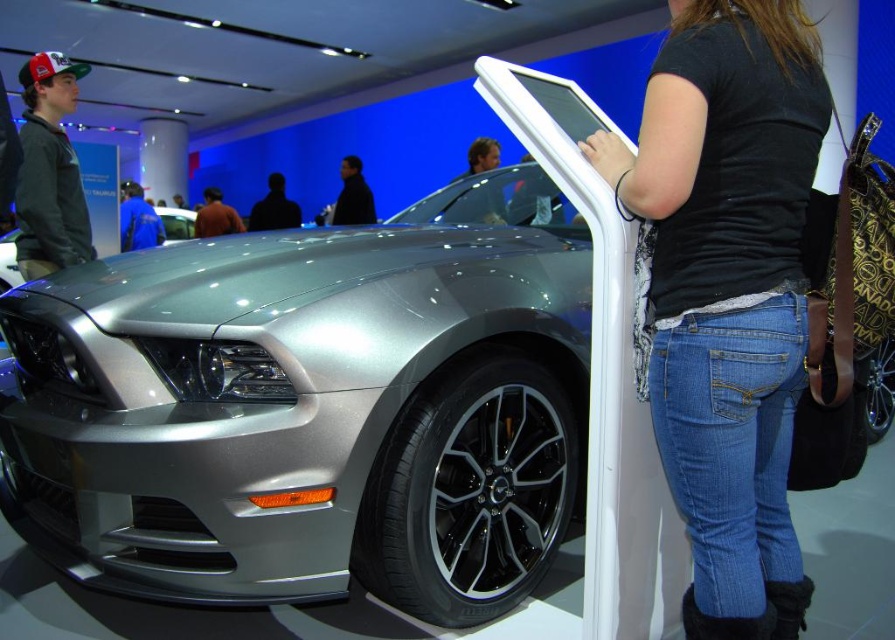
Which is more to the right, dark blue shirt at center or satin silver car at center?

dark blue shirt at center

Between point (362, 182) and point (166, 221), which one is positioned in front?

Point (166, 221) is in front.

Locate an element on the screen. dark blue shirt at center is located at coordinates (352, 195).

Is dark blue shirt at center above brown sweater at center?

Yes.

Does dark blue shirt at center have a lesser width compared to brown sweater at center?

No.

I want to click on dark blue shirt at center, so click(352, 195).

Is black denim jeans at center bigger than dark blue shirt at center?

No, black denim jeans at center is not bigger than dark blue shirt at center.

Does black denim jeans at center have a greater width compared to dark blue shirt at center?

Incorrect, black denim jeans at center's width does not surpass dark blue shirt at center's.

This screenshot has width=895, height=640. Identify the location of black denim jeans at center. (729, 291).

Locate an element on the screen. black denim jeans at center is located at coordinates (729, 291).